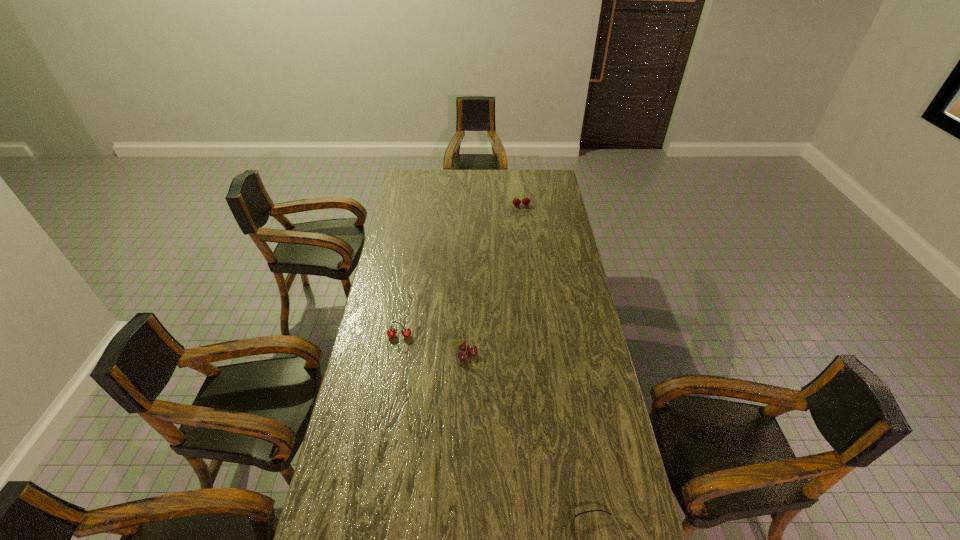
Locate an element on the screen. Image resolution: width=960 pixels, height=540 pixels. vacant area at the far edge of the desktop is located at coordinates (514, 188).

In the image, there is a desktop. Find the location of `vacant space at the left edge`. vacant space at the left edge is located at coordinates (402, 192).

The image size is (960, 540). In order to click on free area in between the second cherry from right to left and the tallest object in this screenshot , I will do `click(493, 280)`.

Where is `vacant area that lies between the second nearest cherry and the third object from right to left`? Image resolution: width=960 pixels, height=540 pixels. vacant area that lies between the second nearest cherry and the third object from right to left is located at coordinates (432, 345).

Locate an element on the screen. free space between the second farthest cherry and the third farthest object is located at coordinates (432, 345).

This screenshot has width=960, height=540. In order to click on free spot between the second nearest object and the farthest cherry in this screenshot , I will do `click(493, 280)`.

Locate an element on the screen. vacant area that lies between the leftmost object and the rightmost cherry is located at coordinates (460, 271).

Image resolution: width=960 pixels, height=540 pixels. In order to click on the second closest object to the second nearest object in this screenshot , I will do `click(576, 515)`.

I want to click on object that is the nearest to the tallest cherry, so click(x=463, y=346).

The image size is (960, 540). Find the location of `cherry that can be found as the closest to the leftmost cherry`. cherry that can be found as the closest to the leftmost cherry is located at coordinates (463, 346).